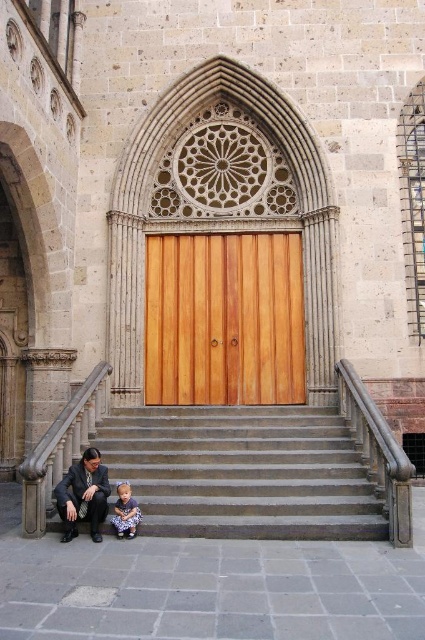
Between wooden door at center and dark gray suit at lower left, which one appears on the left side from the viewer's perspective?

dark gray suit at lower left is more to the left.

Which is behind, point (175, 244) or point (65, 477)?

Positioned behind is point (175, 244).

Find the location of `wooden door at center`. wooden door at center is located at coordinates (223, 320).

Does gray stone stairs at lower center have a lesser width compared to matte purple dress at lower left?

No, gray stone stairs at lower center is not thinner than matte purple dress at lower left.

Is the position of gray stone stairs at lower center more distant than that of matte purple dress at lower left?

No, gray stone stairs at lower center is in front of matte purple dress at lower left.

Is point (172, 420) closer to viewer compared to point (133, 509)?

No, (172, 420) is behind (133, 509).

Where is `gray stone stairs at lower center`? This screenshot has height=640, width=425. gray stone stairs at lower center is located at coordinates (243, 472).

Between gray stone stairs at lower center and wooden door at center, which one appears on the right side from the viewer's perspective?

wooden door at center

Between gray stone stairs at lower center and wooden door at center, which one is positioned lower?

Positioned lower is gray stone stairs at lower center.

Locate an element on the screen. gray stone stairs at lower center is located at coordinates (243, 472).